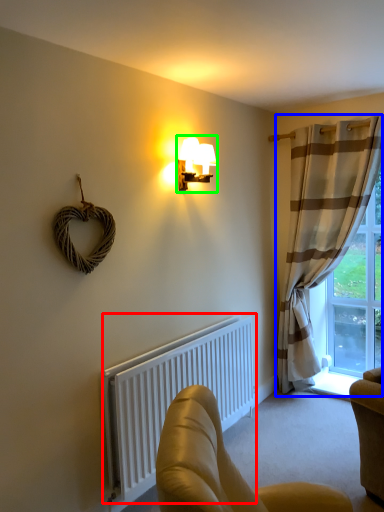
Question: Which object is the farthest from radiator (highlighted by a red box)? Choose among these: curtain (highlighted by a blue box) or lamp (highlighted by a green box).

Choices:
 (A) curtain
 (B) lamp

Answer: (B)